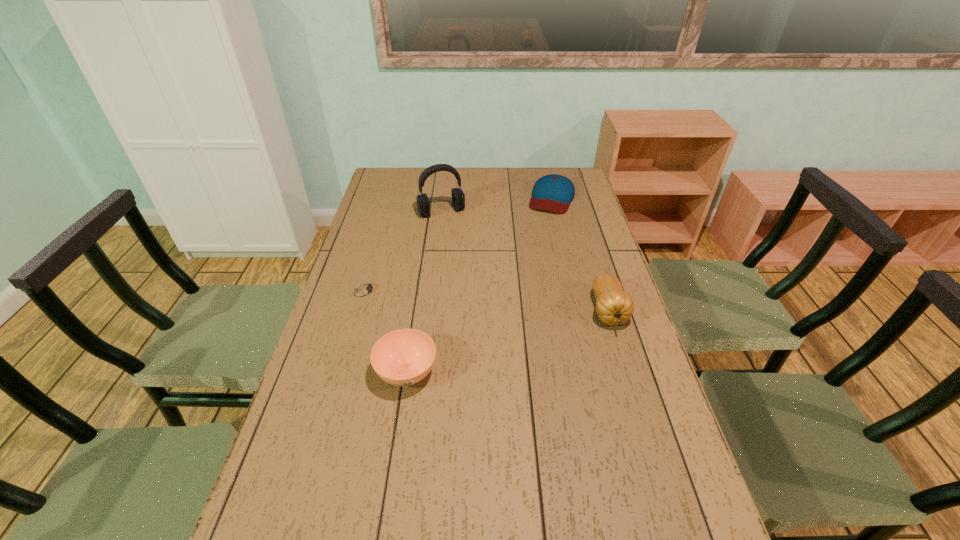
Image resolution: width=960 pixels, height=540 pixels. What are the coordinates of `soup bowl` in the screenshot? It's located at (403, 357).

Identify the location of the fourth shortest object. Image resolution: width=960 pixels, height=540 pixels. (614, 306).

Image resolution: width=960 pixels, height=540 pixels. I want to click on the tallest object, so click(458, 198).

At what (x,y) coordinates should I click in order to perform the action: click on baseball cap. Please return your answer as a coordinate pair (x, y). The image size is (960, 540). Looking at the image, I should click on (553, 192).

At what (x,y) coordinates should I click in order to perform the action: click on the leftmost object. Please return your answer as a coordinate pair (x, y). The image size is (960, 540). Looking at the image, I should click on (365, 289).

I want to click on watch, so click(x=365, y=289).

Image resolution: width=960 pixels, height=540 pixels. Identify the location of vacant space located 0.310m on the back of the soup bowl. (421, 276).

Locate an element on the screen. This screenshot has width=960, height=540. free region located on the stem side of the gourd is located at coordinates coord(649,443).

Identify the location of free space located on the headband of the headset. Image resolution: width=960 pixels, height=540 pixels. (459, 239).

This screenshot has height=540, width=960. Find the location of `blank area located 0.080m on the headband of the headset`. blank area located 0.080m on the headband of the headset is located at coordinates click(455, 232).